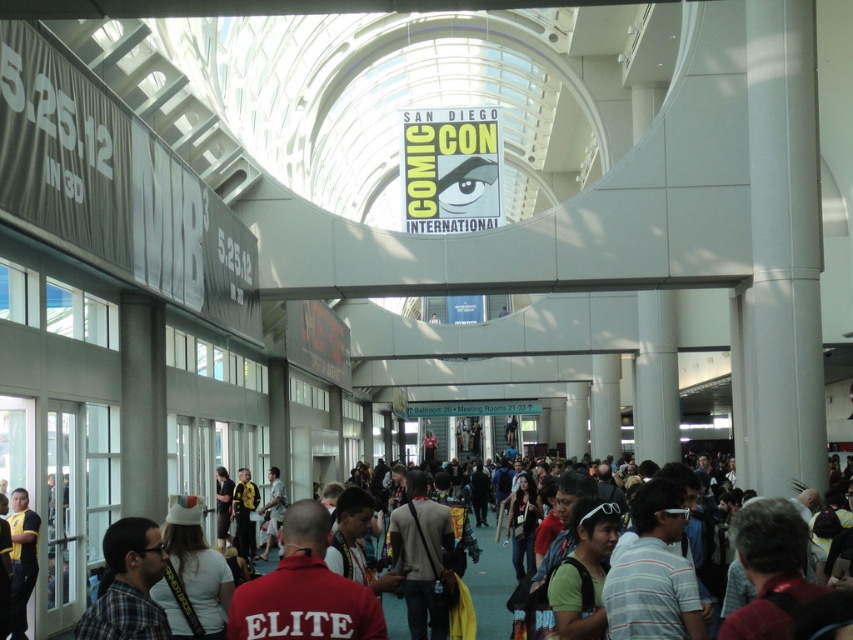
What is the relationship between the multicolored fabric crowd at center and the yellow jersey at center in terms of their positioning?

The multicolored fabric crowd at center is positioned under the yellow jersey at center.

You are at the convention center and see a plaid shirt at lower left and a yellow jersey at center. Which one is positioned to the right of the other?

The plaid shirt at lower left is to the right of the yellow jersey at center.